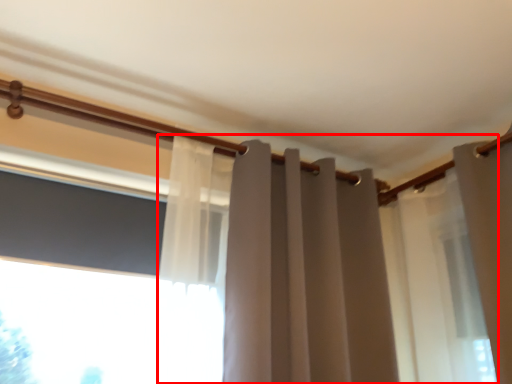
Question: From the image's perspective, where is curtain (annotated by the red box) located in relation to window screen in the image?

Choices:
 (A) below
 (B) above

Answer: (A)